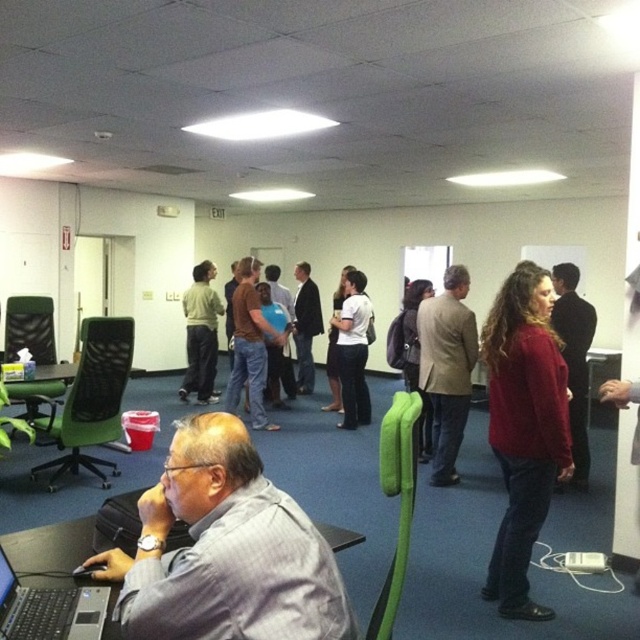
Who is lower down, gray striped shirt at lower left or matte red sweater at center?

matte red sweater at center is below.

Measure the distance between gray striped shirt at lower left and matte red sweater at center.

They are 1.88 meters apart.

Where is `gray striped shirt at lower left`? Image resolution: width=640 pixels, height=640 pixels. gray striped shirt at lower left is located at coordinates (225, 550).

Does green mesh swivel chair at left have a lesser height compared to light brown textured blazer at center?

Yes.

Which of these two, green mesh swivel chair at left or light brown textured blazer at center, stands taller?

Standing taller between the two is light brown textured blazer at center.

Locate an element on the screen. This screenshot has height=640, width=640. green mesh swivel chair at left is located at coordinates (92, 397).

Which is behind, point (570, 429) or point (369, 300)?

The point (369, 300) is behind.

Can you confirm if red sweater at center is thinner than dark gray sweater at center?

Indeed, red sweater at center has a lesser width compared to dark gray sweater at center.

The height and width of the screenshot is (640, 640). Identify the location of red sweater at center. (573, 358).